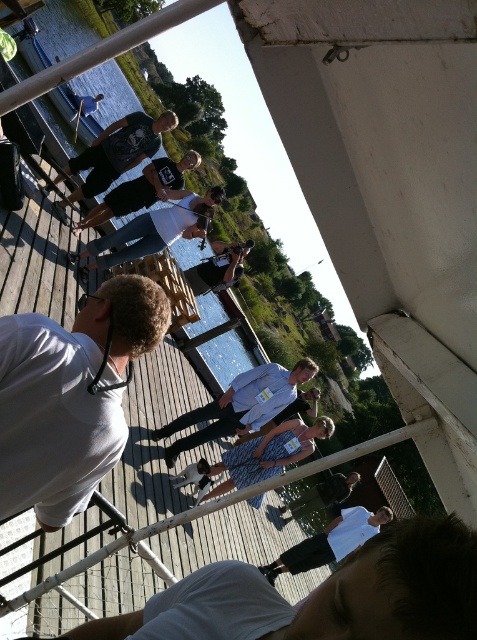
From the picture: You are standing at the edge of the wooden dock and want to take a photo of both the point at coordinates (117, 140) and the point at (329, 547). Which point should you focus on first to ensure both are in the frame?

You should focus on point (117, 140) first because it is closer to the viewer than point (329, 547), ensuring both points are within the camera frame.